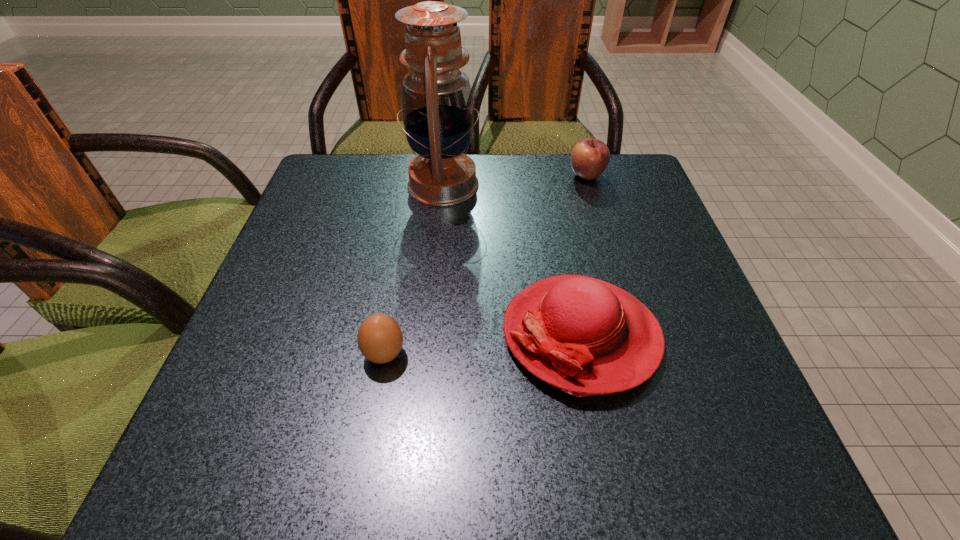
The height and width of the screenshot is (540, 960). Find the location of `oil lamp`. oil lamp is located at coordinates (437, 108).

Locate an element on the screen. apple is located at coordinates (589, 158).

I want to click on hat, so click(x=582, y=335).

I want to click on boiled egg, so click(380, 339).

You are a GUI agent. You are given a task and a screenshot of the screen. Output one action in this format:
    pyautogui.click(x=<x>, y=<y>)
    Task: Click on the free space located on the right of the tallest object
    The width and height of the screenshot is (960, 540).
    Given the screenshot: What is the action you would take?
    pyautogui.click(x=525, y=185)

At what (x,y) coordinates should I click in order to perform the action: click on free location located 0.250m on the front of the apple. Please return your answer as a coordinate pair (x, y). This screenshot has width=960, height=540. Looking at the image, I should click on pyautogui.click(x=612, y=259).

The width and height of the screenshot is (960, 540). Find the location of `vacant space located 0.270m at the front of the hat with a bow`. vacant space located 0.270m at the front of the hat with a bow is located at coordinates (343, 334).

Where is `vacant space located at the front of the hat with a bow`? vacant space located at the front of the hat with a bow is located at coordinates (378, 334).

The width and height of the screenshot is (960, 540). Find the location of `free space located 0.300m at the front of the hat with a bow`. free space located 0.300m at the front of the hat with a bow is located at coordinates (325, 334).

The image size is (960, 540). I want to click on vacant space positioned on the back of the boiled egg, so click(409, 218).